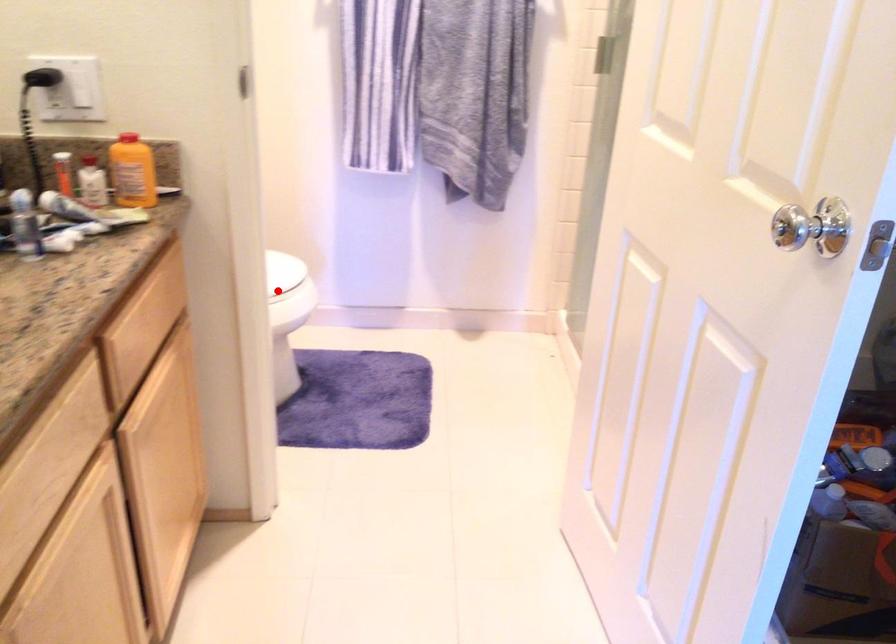
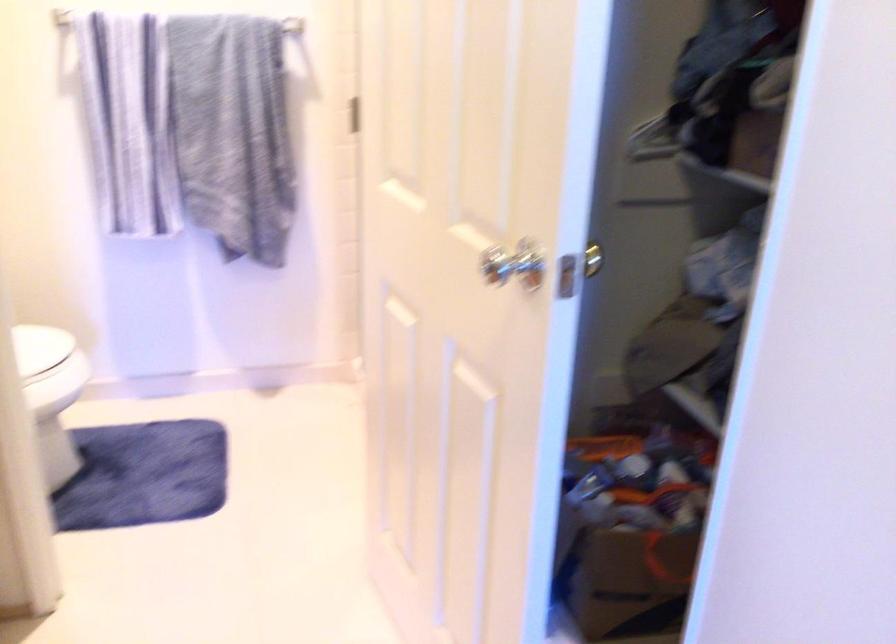
Where in the second image is the point corresponding to the highlighted location from the first image?

(45, 368)